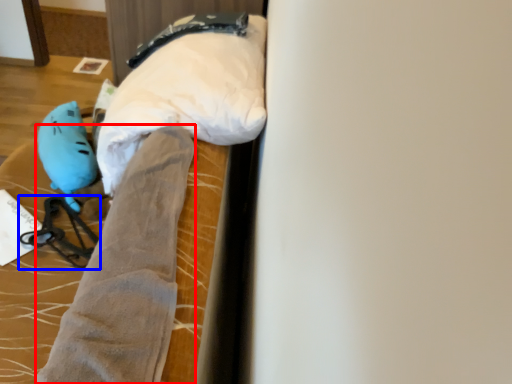
Question: Which of the following is the farthest to the observer, tight (highlighted by a red box) or twin (highlighted by a blue box)?

Choices:
 (A) tight
 (B) twin

Answer: (B)